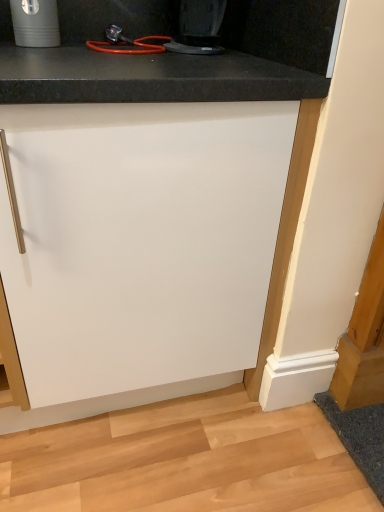
Measure the distance between black plastic coffee maker at upper center and camera.

black plastic coffee maker at upper center is 37.86 inches away from camera.

What is the approximate width of white matte cabinet at center?

white matte cabinet at center is 24.74 inches wide.

Image resolution: width=384 pixels, height=512 pixels. What do you see at coordinates (35, 23) in the screenshot? I see `matte black cup at upper left` at bounding box center [35, 23].

Looking at this image, measure the distance between matte black cup at upper left and camera.

A distance of 39.08 inches exists between matte black cup at upper left and camera.

I want to click on black plastic coffee maker at upper center, so click(198, 27).

What's the angular difference between white matte cabinet at center and matte black cup at upper left's facing directions?

They differ by 2.07 degrees in their facing directions.

Which is more to the left, white matte cabinet at center or matte black cup at upper left?

From the viewer's perspective, matte black cup at upper left appears more on the left side.

Is white matte cabinet at center facing away from matte black cup at upper left?

No, matte black cup at upper left is not at the back of white matte cabinet at center.

Is white matte cabinet at center not near matte black cup at upper left?

white matte cabinet at center is actually quite close to matte black cup at upper left.

Is matte black cup at upper left to the right of black plastic coffee maker at upper center from the viewer's perspective?

No, matte black cup at upper left is not to the right of black plastic coffee maker at upper center.

Would you say matte black cup at upper left is outside black plastic coffee maker at upper center?

Yes.

Considering the sizes of objects matte black cup at upper left and black plastic coffee maker at upper center in the image provided, who is bigger, matte black cup at upper left or black plastic coffee maker at upper center?

Bigger between the two is black plastic coffee maker at upper center.

Which of these two, matte black cup at upper left or black plastic coffee maker at upper center, is thinner?

With smaller width is matte black cup at upper left.

Where is `cabinetry below the black plastic coffee maker at upper center (from the image's perspective)`? cabinetry below the black plastic coffee maker at upper center (from the image's perspective) is located at coordinates (140, 240).

Which of these two, black plastic coffee maker at upper center or white matte cabinet at center, is bigger?

Bigger between the two is white matte cabinet at center.

From the picture: From a real-world perspective, is black plastic coffee maker at upper center above or below white matte cabinet at center?

Clearly, from a real-world perspective, black plastic coffee maker at upper center is above white matte cabinet at center.

Considering the sizes of black plastic coffee maker at upper center and white matte cabinet at center in the image, is black plastic coffee maker at upper center wider or thinner than white matte cabinet at center?

In the image, black plastic coffee maker at upper center appears to be more narrow than white matte cabinet at center.

Which object is wider, matte black cup at upper left or white matte cabinet at center?

With larger width is white matte cabinet at center.

Considering the positions of objects matte black cup at upper left and white matte cabinet at center in the image provided, who is more to the right, matte black cup at upper left or white matte cabinet at center?

Positioned to the right is white matte cabinet at center.

Are matte black cup at upper left and white matte cabinet at center beside each other?

No, matte black cup at upper left is not touching white matte cabinet at center.

Measure the distance between matte black cup at upper left and white matte cabinet at center.

matte black cup at upper left and white matte cabinet at center are 24.96 inches apart from each other.

Is black plastic coffee maker at upper center touching matte black cup at upper left?

They are not placed beside each other.

Based on the photo, can you tell me how much black plastic coffee maker at upper center and matte black cup at upper left differ in facing direction?

There is a 0.00074-degree angle between the facing directions of black plastic coffee maker at upper center and matte black cup at upper left.

Does black plastic coffee maker at upper center appear on the left side of matte black cup at upper left?

No.

From the picture: In terms of height, does black plastic coffee maker at upper center look taller or shorter compared to matte black cup at upper left?

black plastic coffee maker at upper center is shorter than matte black cup at upper left.

Can you confirm if white matte cabinet at center is taller than black plastic coffee maker at upper center?

Indeed, white matte cabinet at center has a greater height compared to black plastic coffee maker at upper center.

Which object is closer to the camera, white matte cabinet at center or black plastic coffee maker at upper center?

white matte cabinet at center.

Is black plastic coffee maker at upper center inside white matte cabinet at center?

No, black plastic coffee maker at upper center is located outside of white matte cabinet at center.

In the scene shown: Could you tell me if white matte cabinet at center is facing black plastic coffee maker at upper center?

No, white matte cabinet at center is not oriented towards black plastic coffee maker at upper center.

Locate an element on the screen. This screenshot has width=384, height=512. appliance that is above the white matte cabinet at center (from the image's perspective) is located at coordinates (35, 23).

The width and height of the screenshot is (384, 512). Identify the location of appliance behind the black plastic coffee maker at upper center. (35, 23).

Looking at the image, which one is located closer to white matte cabinet at center, matte black cup at upper left or black plastic coffee maker at upper center?

The object closer to white matte cabinet at center is black plastic coffee maker at upper center.

From the image, which object appears to be farther from matte black cup at upper left, white matte cabinet at center or black plastic coffee maker at upper center?

Based on the image, white matte cabinet at center appears to be further to matte black cup at upper left.

Estimate the real-world distances between objects in this image. Which object is further from white matte cabinet at center, black plastic coffee maker at upper center or matte black cup at upper left?

matte black cup at upper left is positioned further to the anchor white matte cabinet at center.

Based on their spatial positions, is matte black cup at upper left or white matte cabinet at center further from black plastic coffee maker at upper center?

white matte cabinet at center lies further to black plastic coffee maker at upper center than the other object.

Looking at the image, which one is located further to matte black cup at upper left, black plastic coffee maker at upper center or white matte cabinet at center?

The object further to matte black cup at upper left is white matte cabinet at center.

Considering their positions, is white matte cabinet at center positioned closer to black plastic coffee maker at upper center than matte black cup at upper left?

Among the two, matte black cup at upper left is located nearer to black plastic coffee maker at upper center.

Where is `home appliance between matte black cup at upper left and white matte cabinet at center in the vertical direction`? This screenshot has width=384, height=512. home appliance between matte black cup at upper left and white matte cabinet at center in the vertical direction is located at coordinates (198, 27).